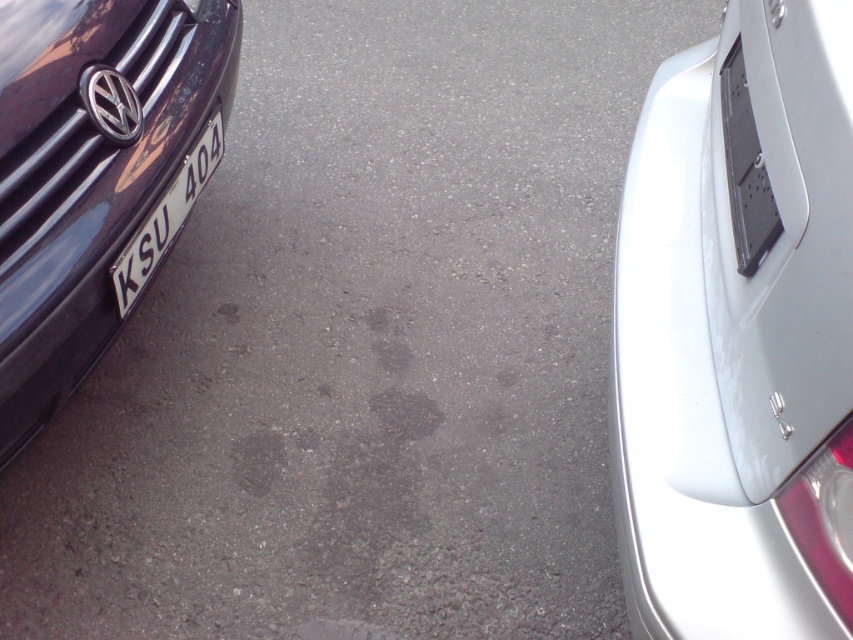
Question: Based on their relative distances, which object is farther from the satin white bumper at right?

Choices:
 (A) white glossy license plate at left
 (B) glossy black car at left

Answer: (A)

Question: Is satin white bumper at right to the right of white glossy license plate at left from the viewer's perspective?

Choices:
 (A) no
 (B) yes

Answer: (B)

Question: Which point is farther to the camera?

Choices:
 (A) (4, 433)
 (B) (785, 547)
 (C) (181, 193)

Answer: (C)

Question: Does glossy black car at left have a greater width compared to white glossy license plate at left?

Choices:
 (A) yes
 (B) no

Answer: (A)

Question: Is satin white bumper at right positioned at the back of white glossy license plate at left?

Choices:
 (A) yes
 (B) no

Answer: (B)

Question: Among these objects, which one is nearest to the camera?

Choices:
 (A) white glossy license plate at left
 (B) satin white bumper at right
 (C) glossy black car at left

Answer: (B)